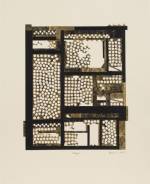
Find the location of a particular element. This screenshot has height=184, width=150. square room is located at coordinates (51, 136), (86, 49), (76, 100), (116, 97).